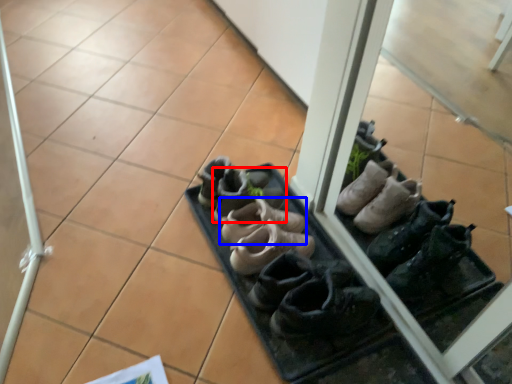
Question: Which object is closer to the camera taking this photo, footwear (highlighted by a red box) or footwear (highlighted by a blue box)?

Choices:
 (A) footwear
 (B) footwear

Answer: (B)